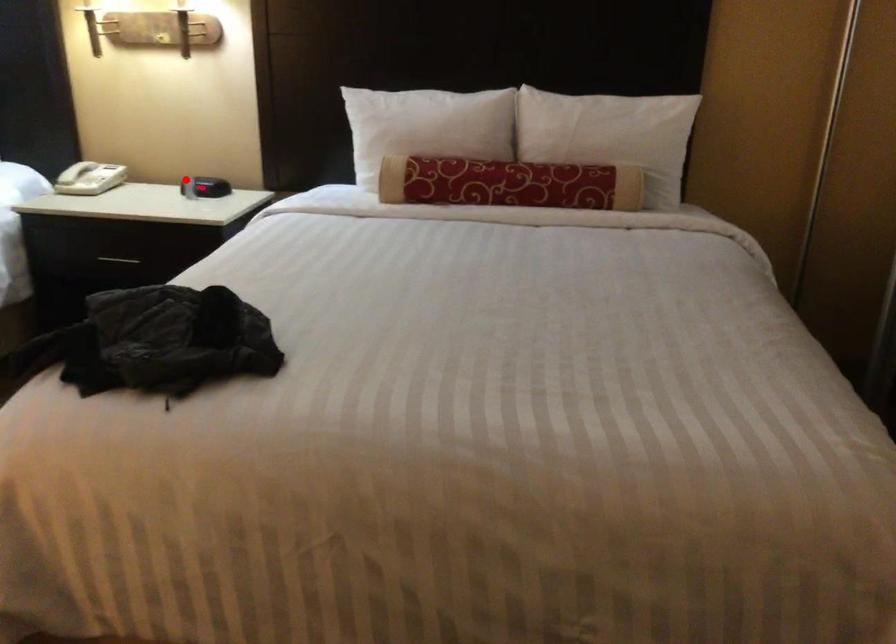
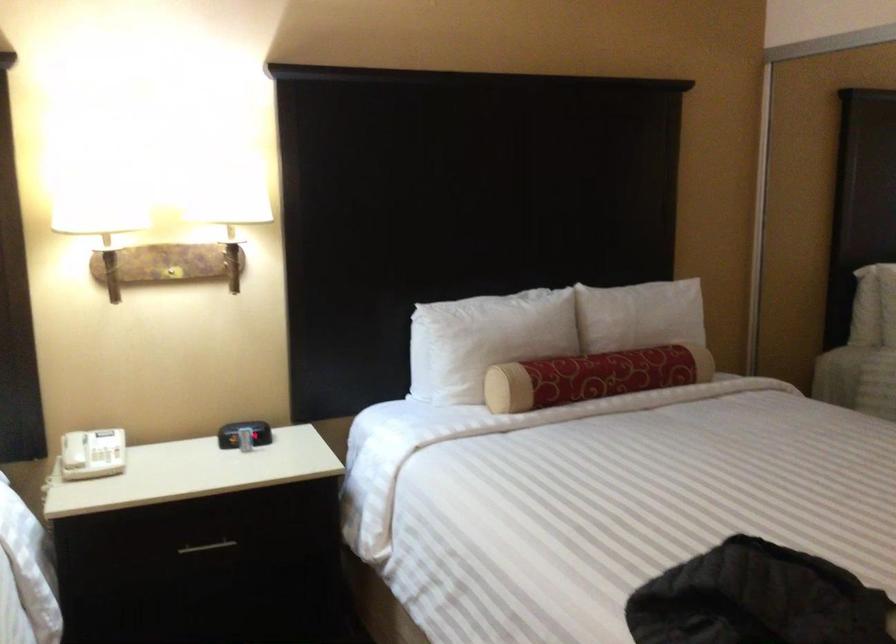
Locate, in the second image, the point that corresponds to the highlighted location in the first image.

(244, 433)